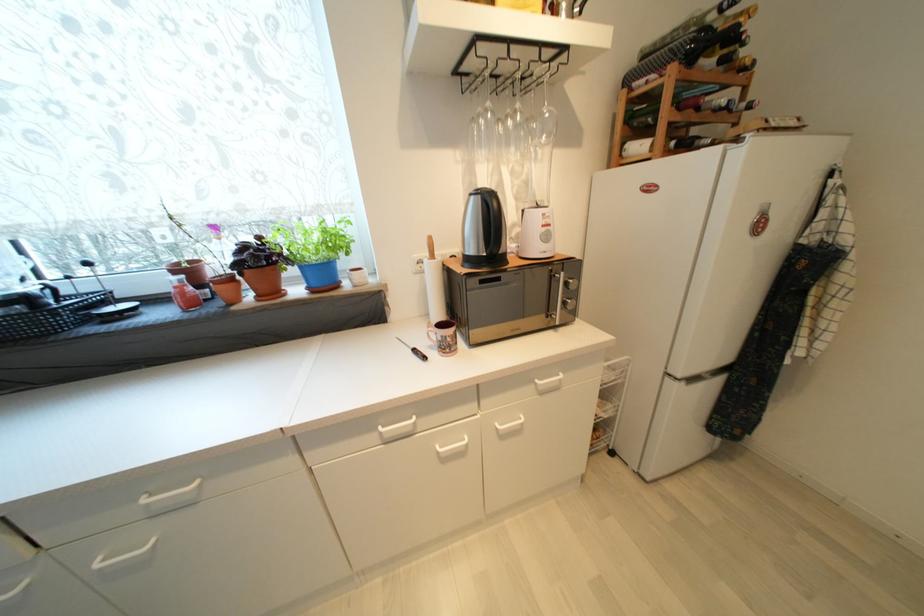
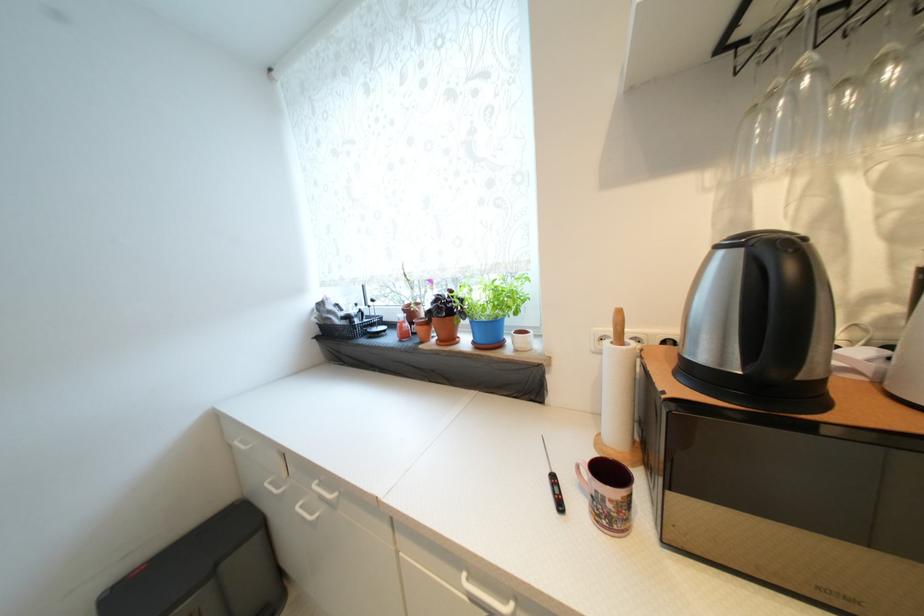
The point at (312, 291) is marked in the first image. Where is the corresponding point in the second image?

(478, 344)